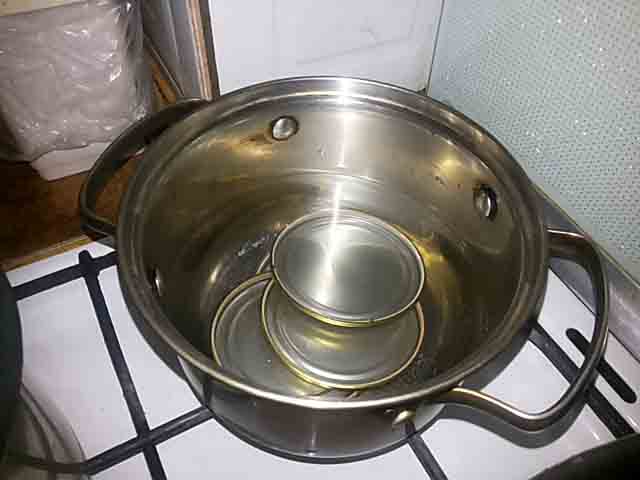
Locate an element on the screen. This screenshot has width=640, height=480. left handle is located at coordinates (93, 217).